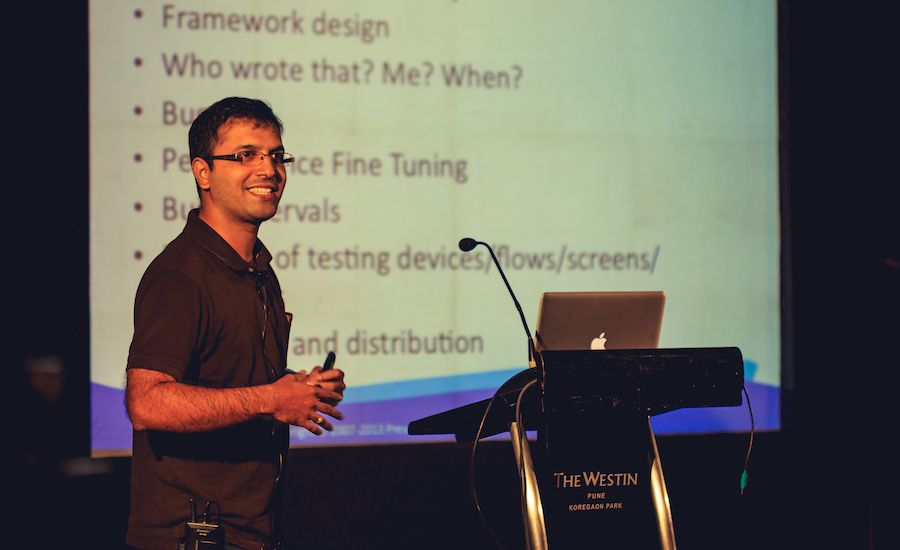
Where is `projector screen`? The image size is (900, 550). projector screen is located at coordinates (615, 166).